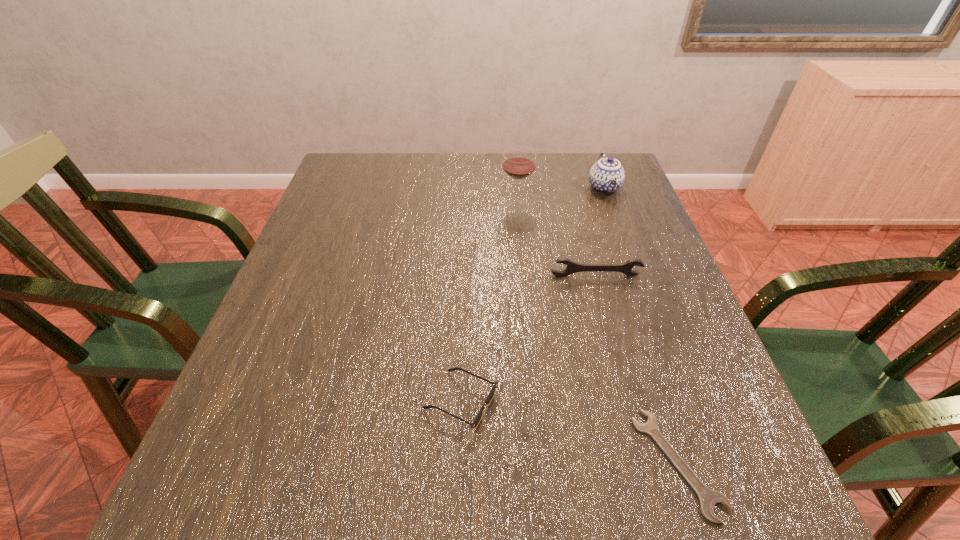
This screenshot has height=540, width=960. What are the coordinates of `free space that satisfies the following two spatial constraints: 1. on the open ends of the farther wrench; 2. on the left side of the shortest object` in the screenshot? It's located at (646, 463).

Find the location of a particular element. Image resolution: width=960 pixels, height=540 pixels. free space that satisfies the following two spatial constraints: 1. on the front side of the shortest object; 2. on the right side of the fourth object from right to left is located at coordinates (542, 463).